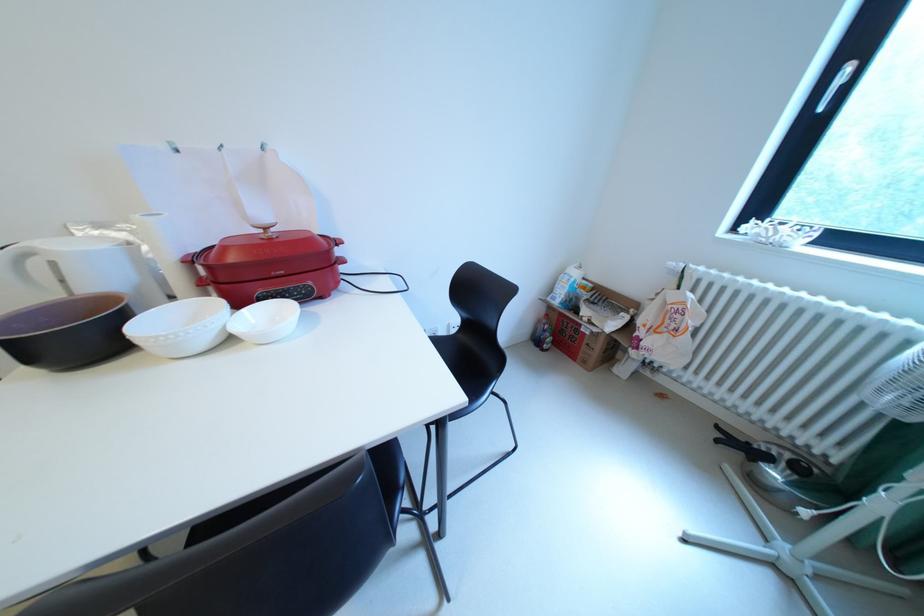
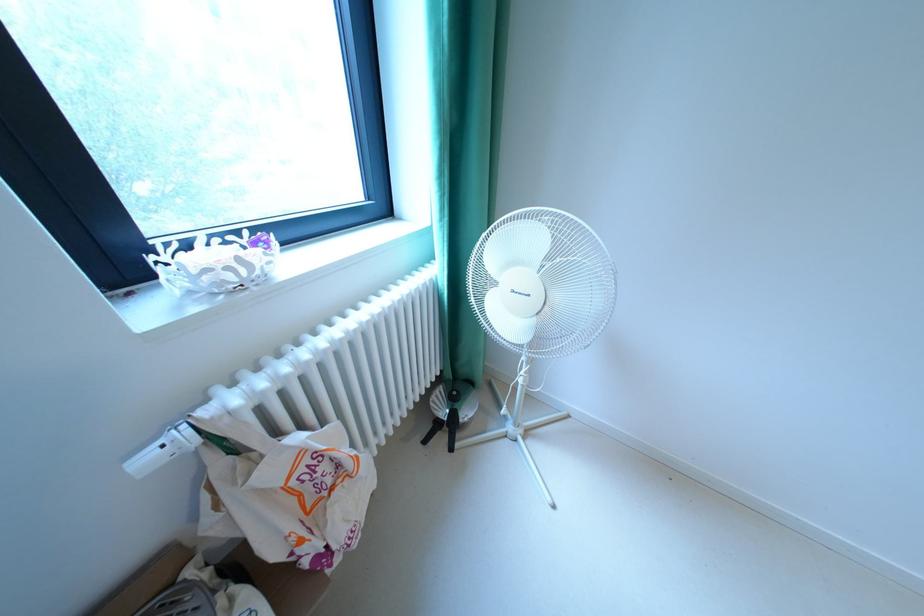
The point at (787, 238) is marked in the first image. Where is the corresponding point in the second image?

(268, 273)